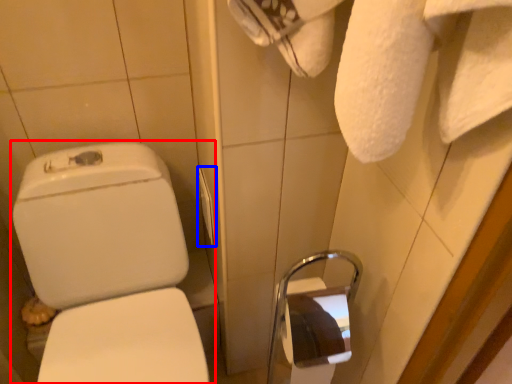
Question: Which object is closer to the camera taking this photo, toilet (highlighted by a red box) or towel bar (highlighted by a blue box)?

Choices:
 (A) toilet
 (B) towel bar

Answer: (A)